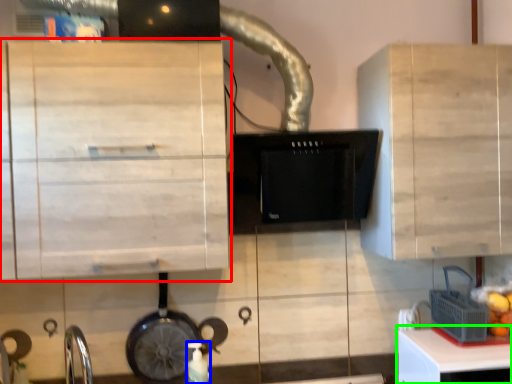
Question: Estimate the real-world distances between objects in this image. Which object is closer to cabinetry (highlighted by a red box), bottle (highlighted by a blue box) or table (highlighted by a green box)?

Choices:
 (A) bottle
 (B) table

Answer: (A)